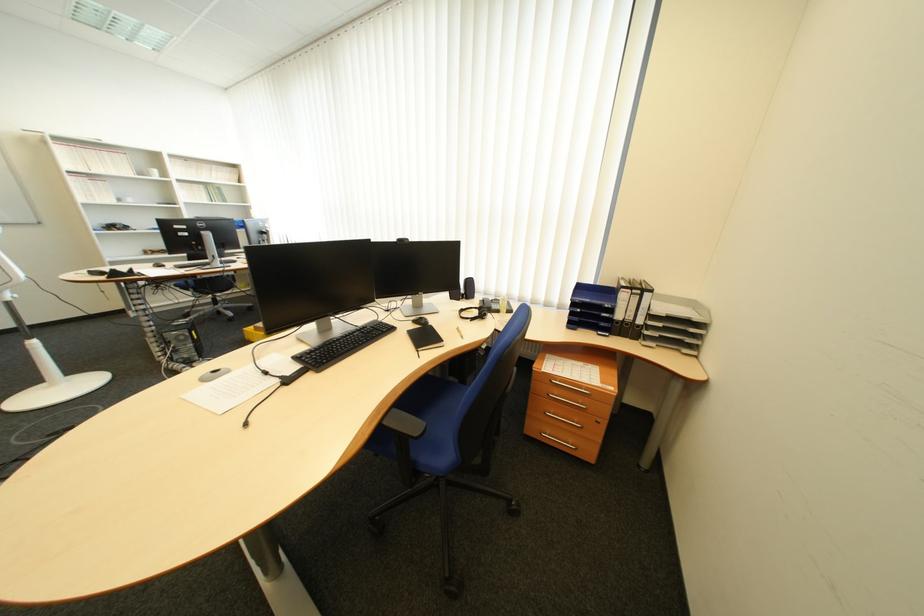
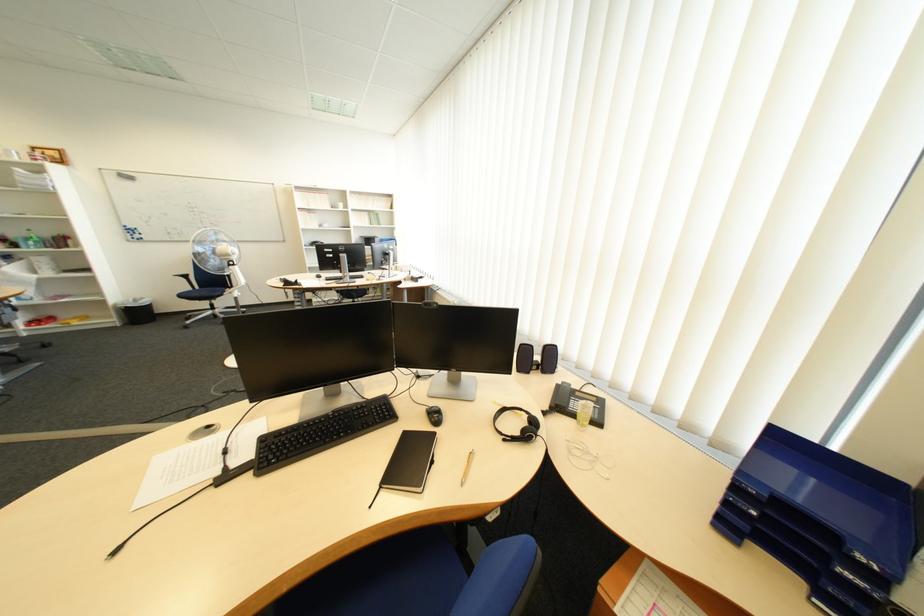
Question: The images are taken continuously from a first-person perspective. In which direction is your viewpoint rotating?

Choices:
 (A) Left
 (B) Right
 (C) Up
 (D) Down

Answer: (A)